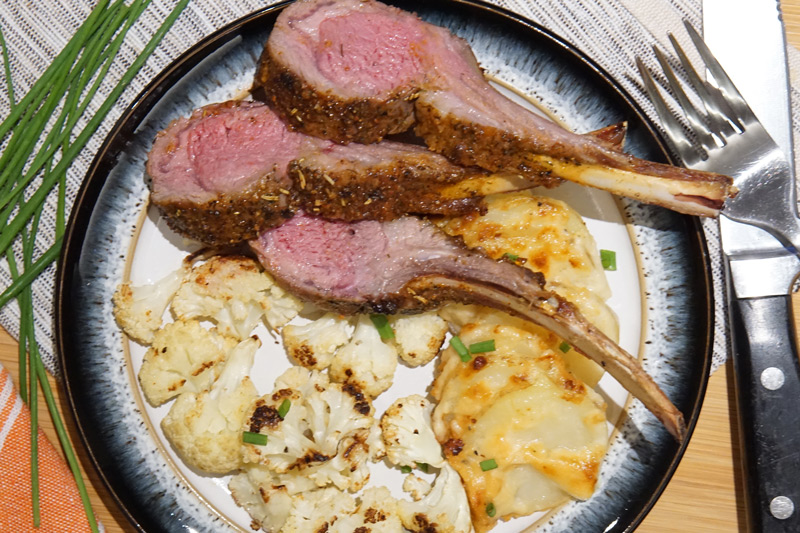
The width and height of the screenshot is (800, 533). What are the coordinates of `fork` in the screenshot? It's located at (754, 180).